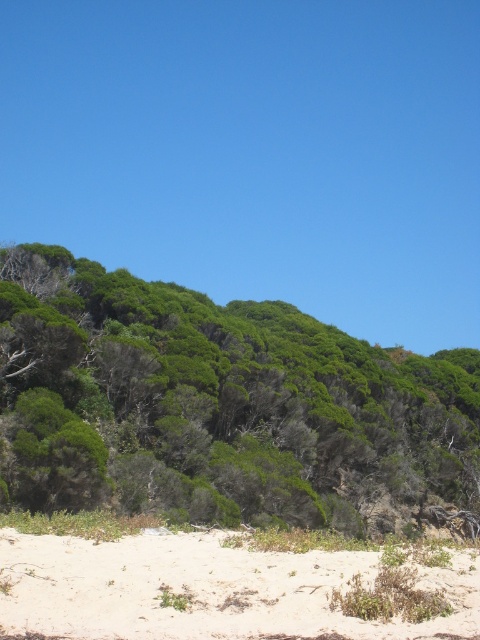
Question: Does green leafy bush at upper center have a lesser width compared to white sandy beach at lower center?

Choices:
 (A) no
 (B) yes

Answer: (A)

Question: Among these objects, which one is farthest from the camera?

Choices:
 (A) white sandy beach at lower center
 (B) green leafy bush at upper center

Answer: (B)

Question: Does green leafy bush at upper center have a smaller size compared to white sandy beach at lower center?

Choices:
 (A) yes
 (B) no

Answer: (B)

Question: Does green leafy bush at upper center appear on the left side of white sandy beach at lower center?

Choices:
 (A) yes
 (B) no

Answer: (B)